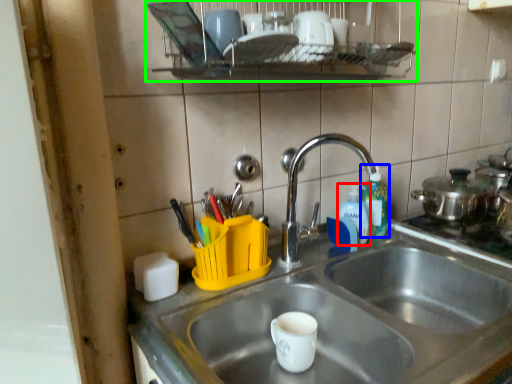
Question: Considering the real-world distances, which object is farthest from bottle (highlighted by a red box)? bottle (highlighted by a blue box) or shelf (highlighted by a green box)?

Choices:
 (A) bottle
 (B) shelf

Answer: (B)